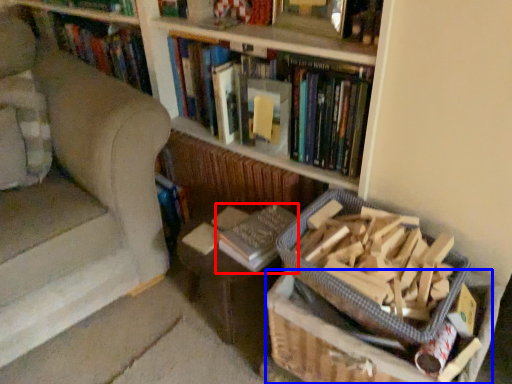
Question: Among these objects, which one is farthest to the camera, book (highlighted by a red box) or cardboard box (highlighted by a blue box)?

Choices:
 (A) book
 (B) cardboard box

Answer: (A)